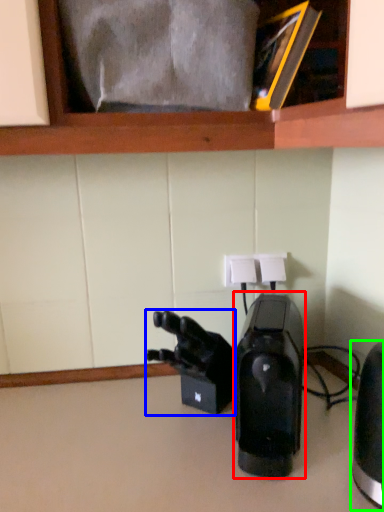
Question: Based on their relative distances, which object is nearer to home appliance (highlighted by a red box)? Choose from video camera (highlighted by a blue box) and home appliance (highlighted by a green box).

Choices:
 (A) video camera
 (B) home appliance

Answer: (A)